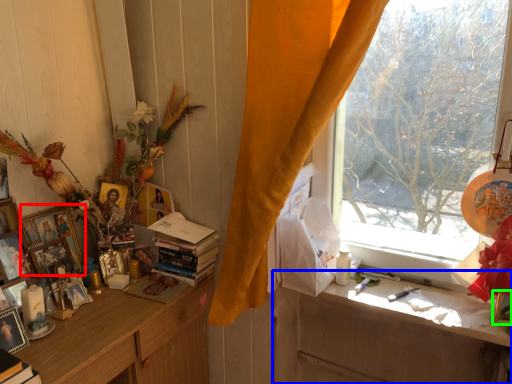
Question: Considering the real-world distances, which object is closest to picture frame (highlighted by a red box)? desk (highlighted by a blue box) or picture frame (highlighted by a green box).

Choices:
 (A) desk
 (B) picture frame

Answer: (A)